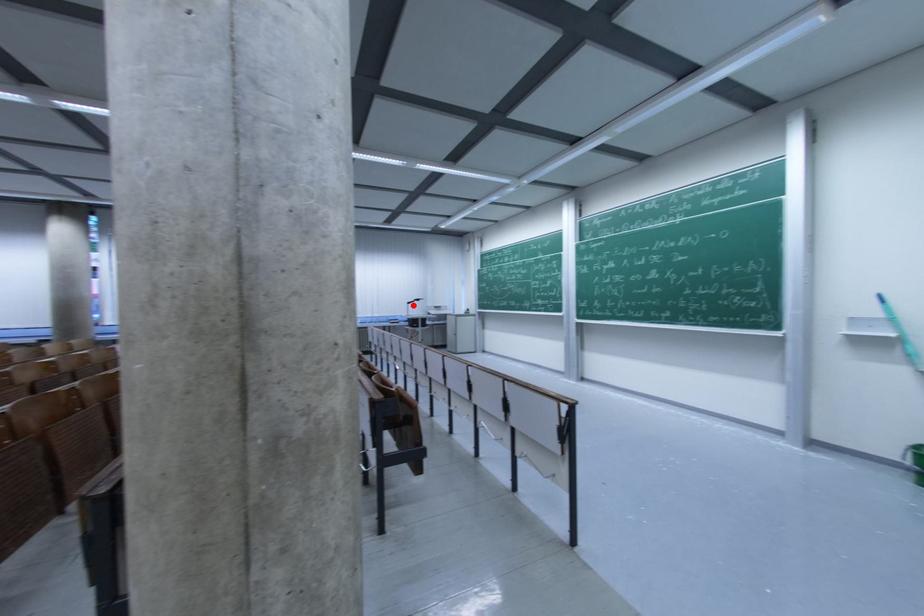
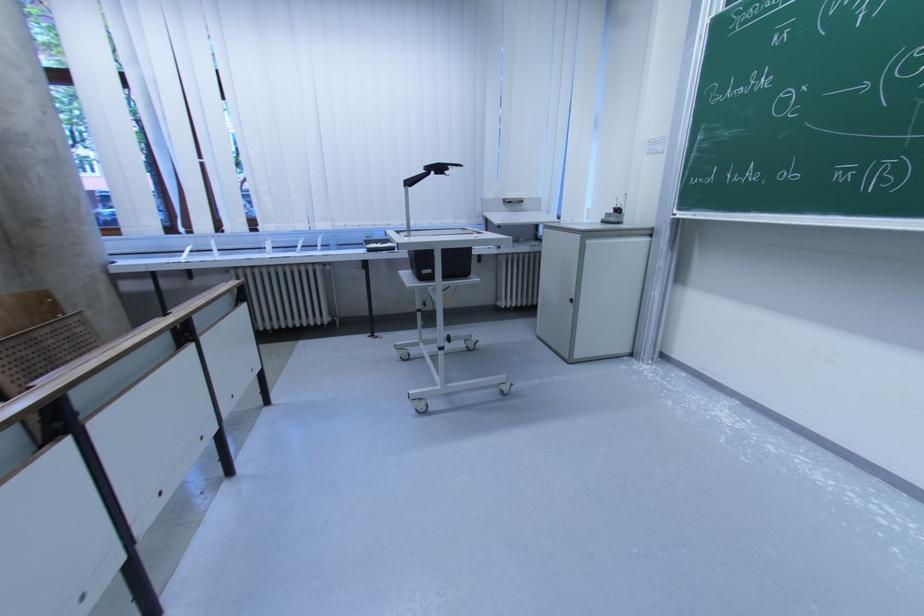
Where in the second image is the point corresponding to the highlighted location from the first image?

(415, 185)